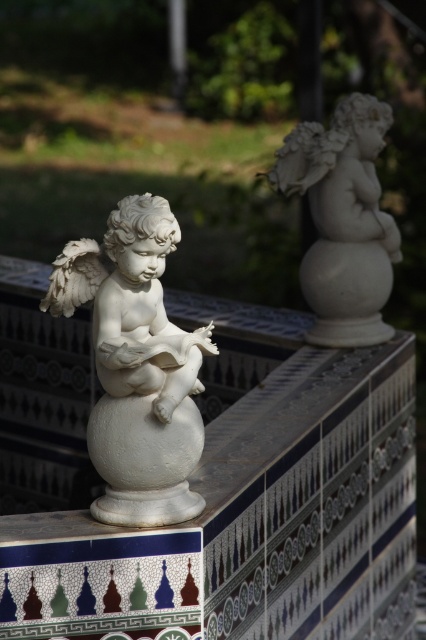
What do you see at coordinates (137, 365) in the screenshot? This screenshot has width=426, height=640. I see `white marble cherub at center` at bounding box center [137, 365].

Is point (92, 268) positioned before point (360, 177)?

That is True.

Describe the element at coordinates (137, 365) in the screenshot. I see `white marble cherub at center` at that location.

Where is `white marble cherub at center`? white marble cherub at center is located at coordinates (137, 365).